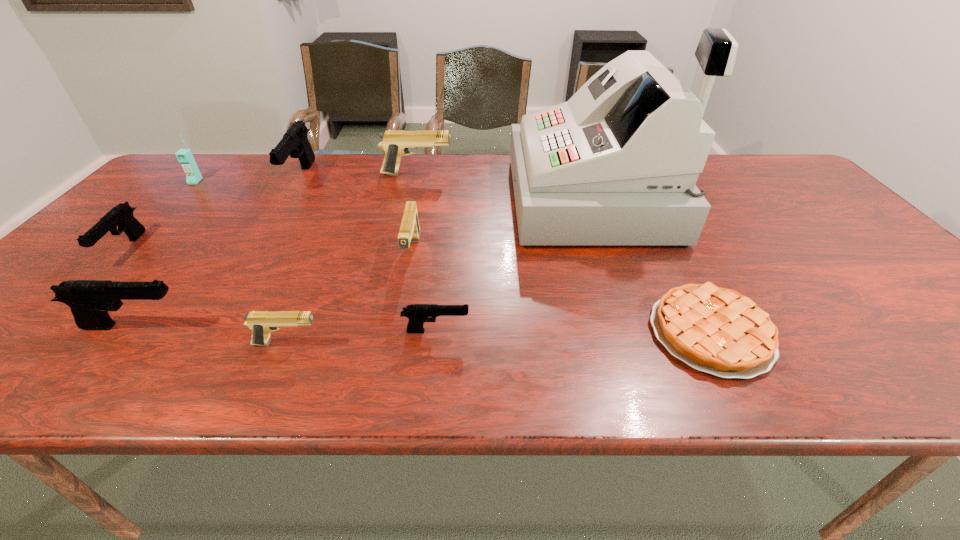
Identify which black pistol is the fourth closest to the gray cash register. Please provide its 2D coordinates. Your answer should be formatted as a tuple, i.e. [(x, y)], where the tuple contains the x and y coordinates of a point satisfying the conditions above.

[(121, 215)]

Locate which black pistol is the fourth closest to the gray cash register. Please provide its 2D coordinates. Your answer should be formatted as a tuple, i.e. [(x, y)], where the tuple contains the x and y coordinates of a point satisfying the conditions above.

[(121, 215)]

This screenshot has width=960, height=540. I want to click on tan pistol that can be found as the second closest to the shortest object, so click(261, 323).

Find the location of a particular element. The image size is (960, 540). tan pistol that stands as the second closest to the cash register is located at coordinates (409, 231).

I want to click on vacant region that satisfies the following two spatial constraints: 1. at the barrel of the biggest tan pistol; 2. on the keypad of the cellular telephone, so click(x=415, y=181).

The height and width of the screenshot is (540, 960). What are the coordinates of `vacant space that satisfies the following two spatial constraints: 1. at the barrel of the farthest tan pistol; 2. on the front-facing side of the leftmost black pistol` in the screenshot? It's located at (399, 249).

Image resolution: width=960 pixels, height=540 pixels. In order to click on free location that satisfies the following two spatial constraints: 1. at the barrel of the second biggest tan pistol; 2. on the front-facing side of the second pistol from left to right in this screenshot , I will do `click(398, 326)`.

At what (x,y) coordinates should I click in order to perform the action: click on vacant space that satisfies the following two spatial constraints: 1. at the barrel of the second farthest tan pistol; 2. on the left side of the pie. Please return your answer as a coordinate pair (x, y). The width and height of the screenshot is (960, 540). Looking at the image, I should click on (397, 333).